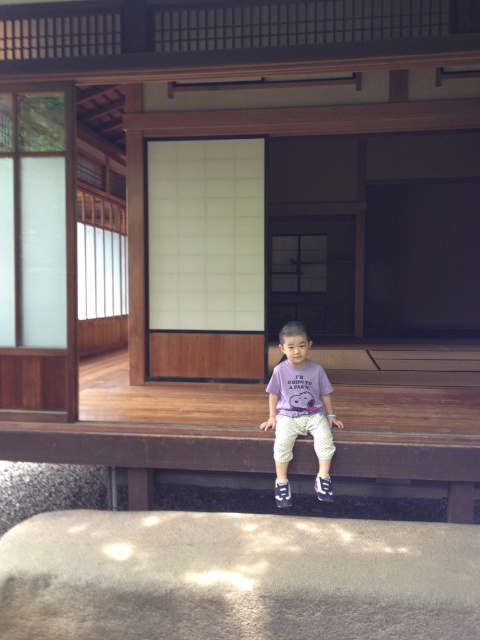
Question: Which point is closer to the camera taking this photo?

Choices:
 (A) (280, 339)
 (B) (52, 432)

Answer: (A)

Question: Is brown wooden ledge at lower center thinner than purple cotton shirt at center?

Choices:
 (A) no
 (B) yes

Answer: (A)

Question: Can you confirm if brown wooden ledge at lower center is positioned above purple cotton shirt at center?

Choices:
 (A) yes
 (B) no

Answer: (B)

Question: Does brown wooden ledge at lower center appear under purple cotton shirt at center?

Choices:
 (A) yes
 (B) no

Answer: (A)